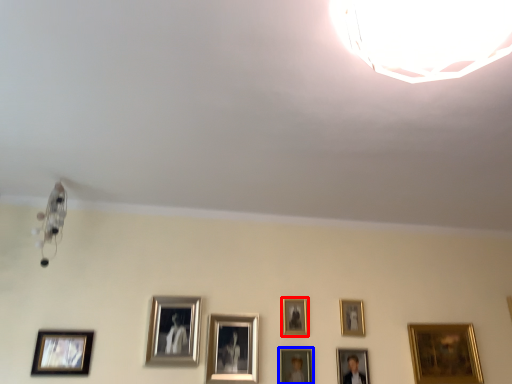
Question: Which of the following is the farthest to the observer, picture frame (highlighted by a red box) or picture frame (highlighted by a blue box)?

Choices:
 (A) picture frame
 (B) picture frame

Answer: (A)